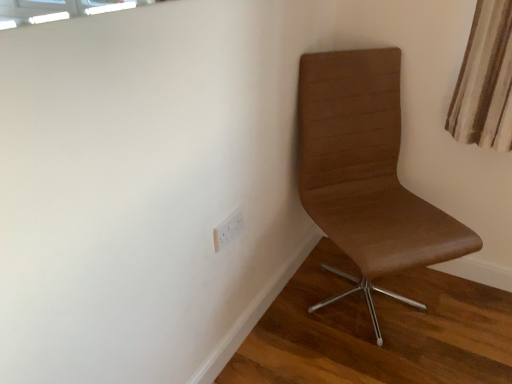
Where is `vacant point to the right of brown leather chair at right`? This screenshot has height=384, width=512. vacant point to the right of brown leather chair at right is located at coordinates (462, 303).